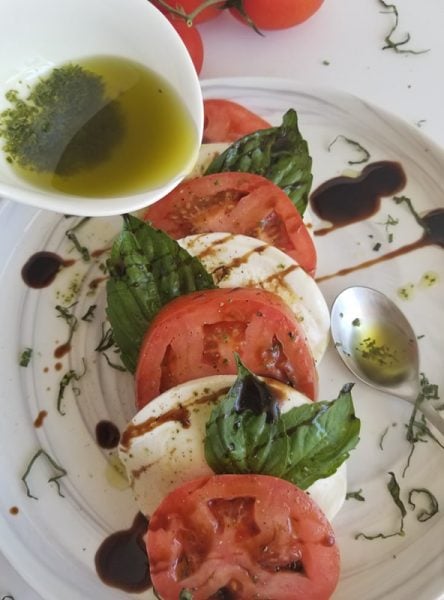
This screenshot has height=600, width=444. I want to click on white table, so click(341, 49).